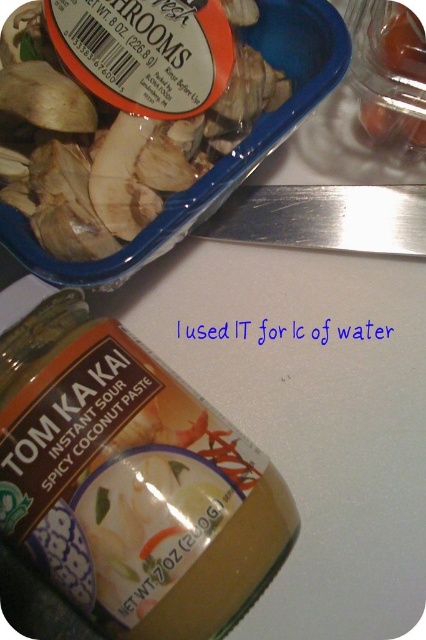
Question: Is white sliced mushrooms at upper left smaller than translucent plastic container at upper right?

Choices:
 (A) no
 (B) yes

Answer: (A)

Question: Among these objects, which one is farthest from the camera?

Choices:
 (A) white sliced mushrooms at upper left
 (B) translucent plastic container at upper right

Answer: (B)

Question: Can you confirm if white sliced mushrooms at upper left is bigger than translucent plastic container at upper right?

Choices:
 (A) no
 (B) yes

Answer: (B)

Question: Is white sliced mushrooms at upper left smaller than translucent plastic container at upper right?

Choices:
 (A) no
 (B) yes

Answer: (A)